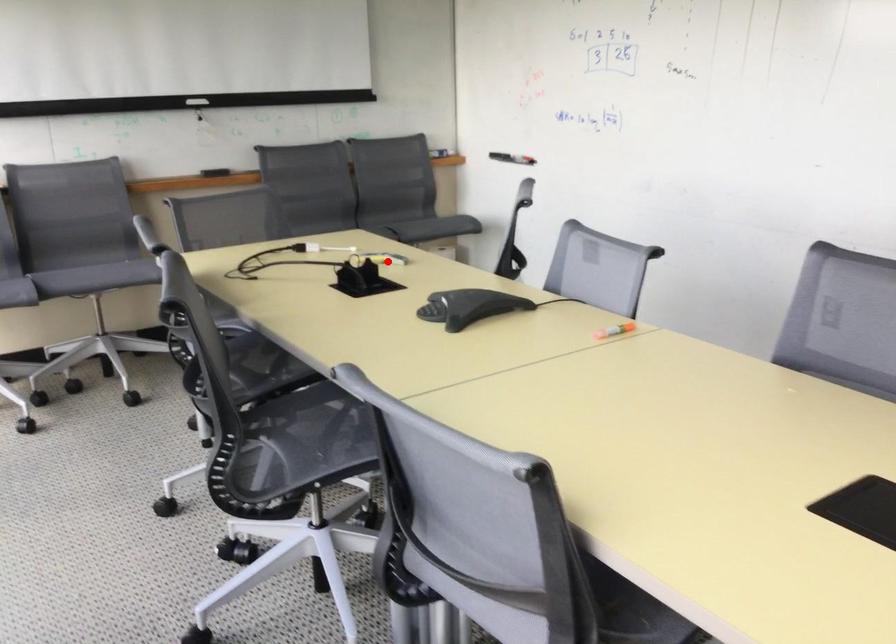
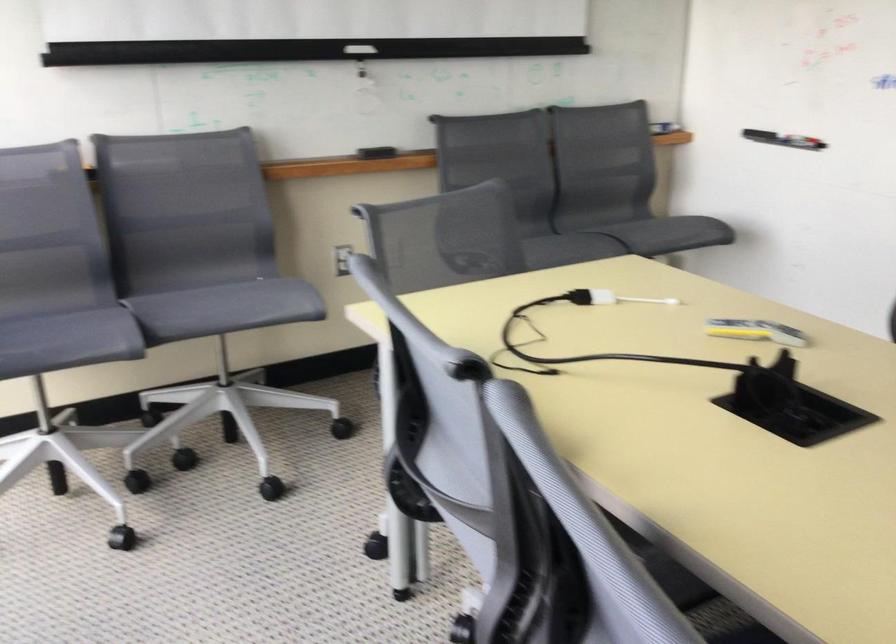
Question: I am providing you with two images of the same scene from different viewpoints. Given a red point in image1, look at the same physical point in image2. Is it:

Choices:
 (A) Closer to the viewpoint
 (B) Farther from the viewpoint

Answer: (A)